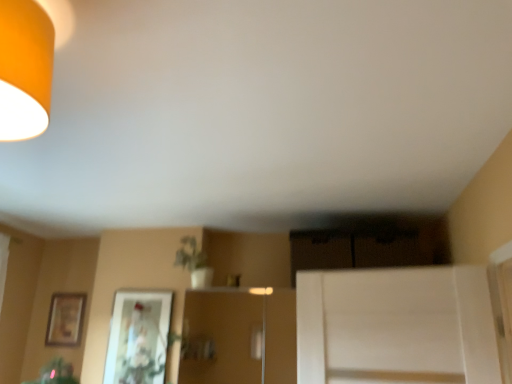
Question: Visually, is green matte plant at center positioned to the left or to the right of wooden framed picture at left, which ranks as the 1th picture frame in left-to-right order?

Choices:
 (A) right
 (B) left

Answer: (A)

Question: Based on their sizes in the image, would you say green matte plant at center is bigger or smaller than wooden framed picture at left, which ranks as the 1th picture frame in left-to-right order?

Choices:
 (A) small
 (B) big

Answer: (B)

Question: Estimate the real-world distances between objects in this image. Which object is closer to the green matte plant at center?

Choices:
 (A) wooden framed picture at left, placed as the first picture frame when sorted from back to front
 (B) matte glass picture frame at center, acting as the 1th picture frame starting from the right
 (C) matte orange lampshade at upper left

Answer: (B)

Question: Estimate the real-world distances between objects in this image. Which object is closer to the wooden framed picture at left, the second picture frame when ordered from right to left?

Choices:
 (A) matte orange lampshade at upper left
 (B) matte glass picture frame at center, the 1th picture frame positioned from the front
 (C) green matte plant at center

Answer: (B)